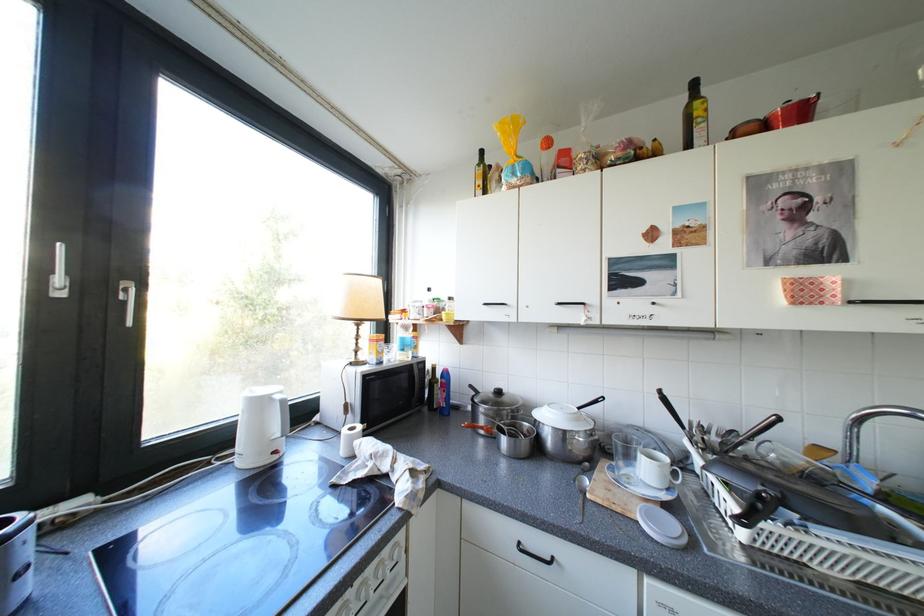
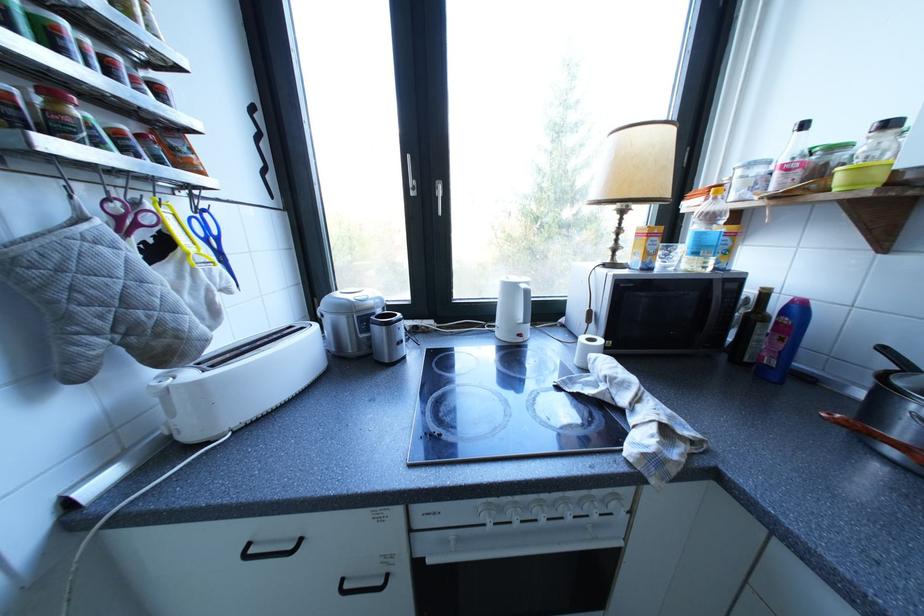
Where in the second image is the point corresponding to the point at 443,379 from the first image?

(760, 315)